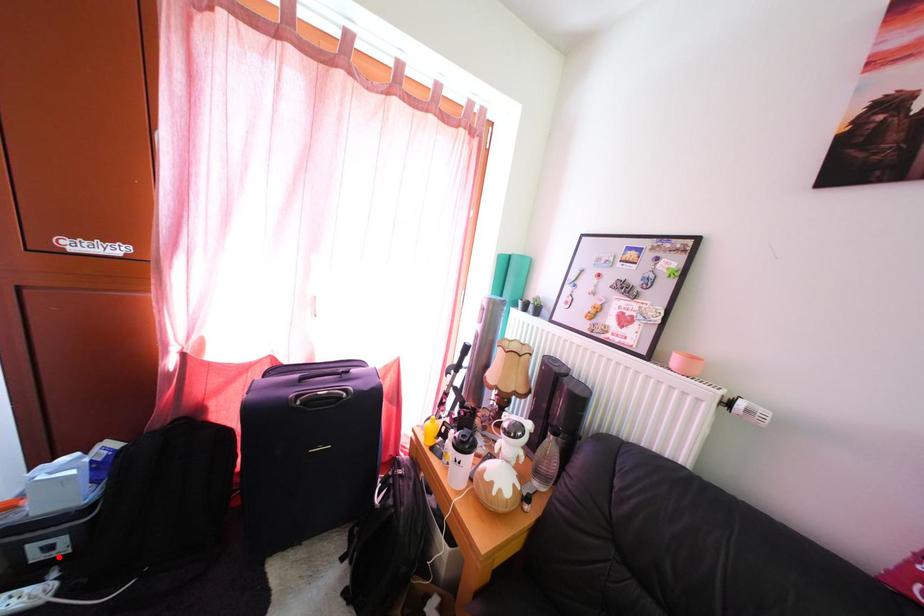
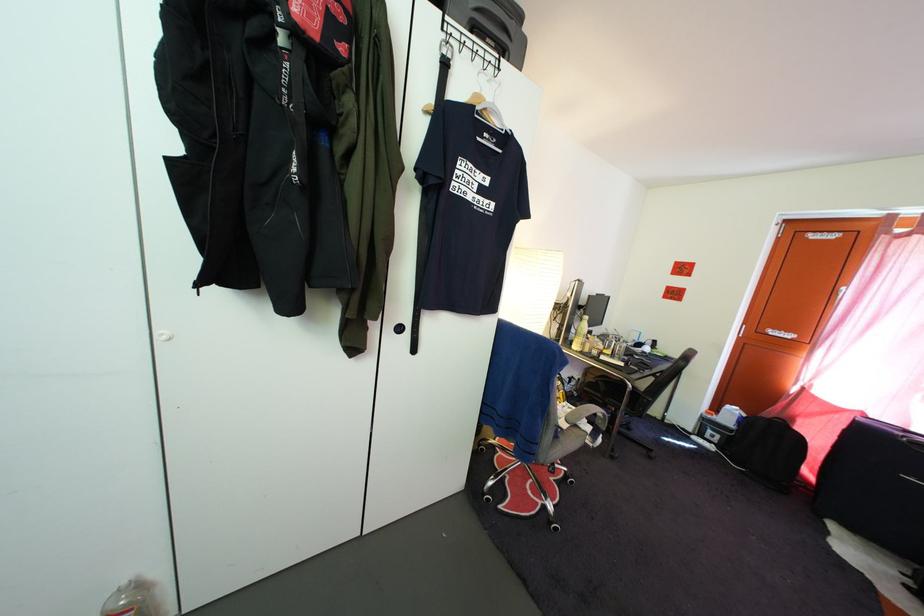
Question: I am providing you with two images of the same scene from different viewpoints. Image1 has a red point marked. In image2, the corresponding 3D location appears at what relative position? Reply with the corresponding letter.

Choices:
 (A) Closer
 (B) Farther

Answer: (B)